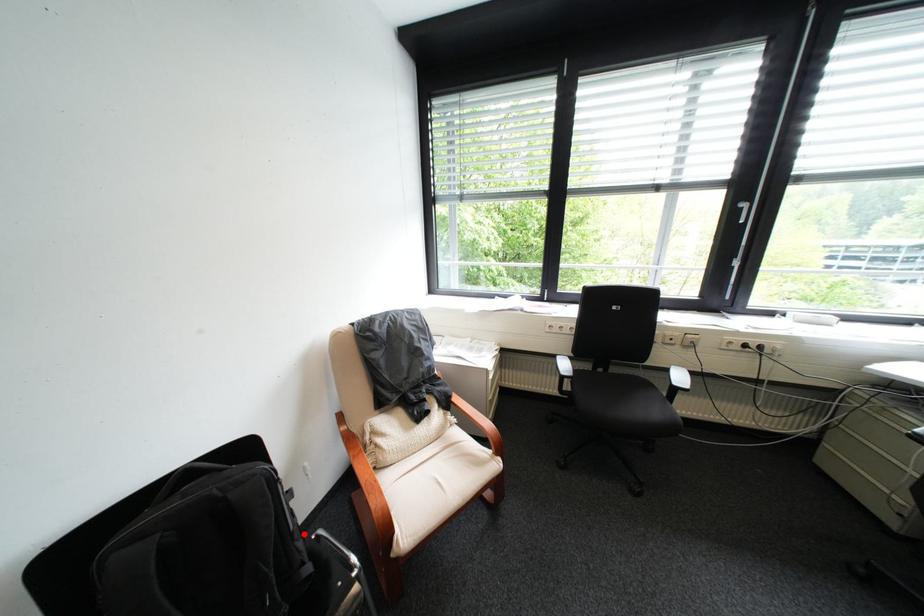
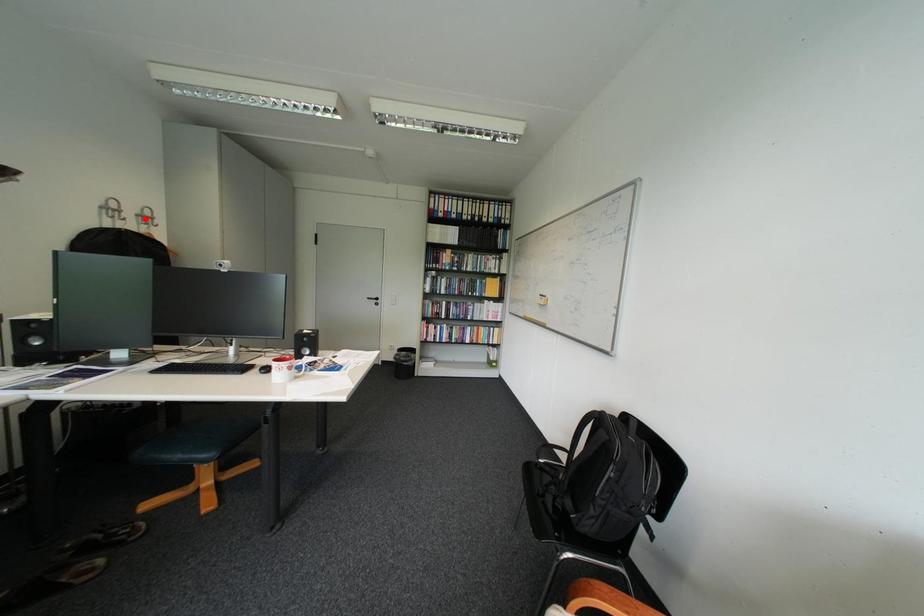
I am providing you with two images of the same scene from different viewpoints. A red point is marked on the first image and another point is marked on the second image. Is the marked point in image1 the same physical position as the marked point in image2?

No